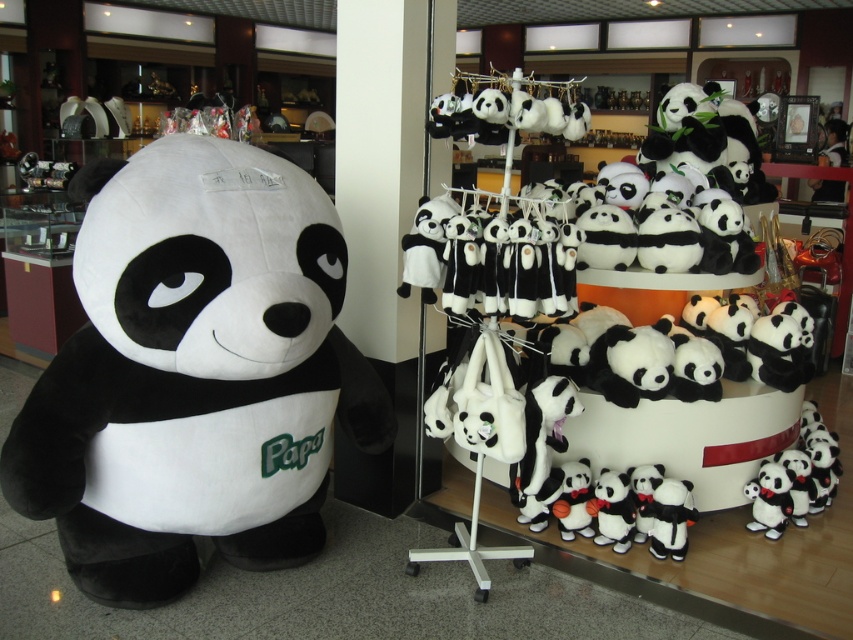
Can you confirm if soft plush panda at left is positioned to the left of soft plush panda at lower right?

Correct, you'll find soft plush panda at left to the left of soft plush panda at lower right.

Between soft plush panda at left and soft plush panda at lower right, which one has more height?

With more height is soft plush panda at left.

Which is behind, point (222, 228) or point (608, 540)?

The point (608, 540) is more distant.

Locate an element on the screen. Image resolution: width=853 pixels, height=640 pixels. soft plush panda at left is located at coordinates (194, 372).

Which is more to the right, soft plush panda at center or soft plush panda at lower right?

soft plush panda at center

Does point (776, 387) come closer to viewer compared to point (613, 550)?

No.

Which is in front, point (612, 406) or point (624, 488)?

Point (624, 488) is in front.

Find the location of a particular element. This screenshot has height=640, width=853. soft plush panda at center is located at coordinates (677, 433).

Image resolution: width=853 pixels, height=640 pixels. Describe the element at coordinates (194, 372) in the screenshot. I see `soft plush panda at left` at that location.

Is soft plush panda at left wider than soft plush panda at center?

Yes, soft plush panda at left is wider than soft plush panda at center.

Where is `soft plush panda at left`? soft plush panda at left is located at coordinates pyautogui.click(x=194, y=372).

Find the location of a particular element. The height and width of the screenshot is (640, 853). soft plush panda at left is located at coordinates (194, 372).